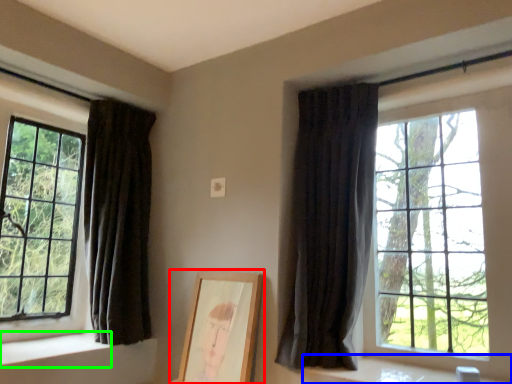
Question: Based on their relative distances, which object is nearer to picture frame (highlighted by a red box)? Choose from window sill (highlighted by a blue box) and window sill (highlighted by a green box).

Choices:
 (A) window sill
 (B) window sill

Answer: (A)